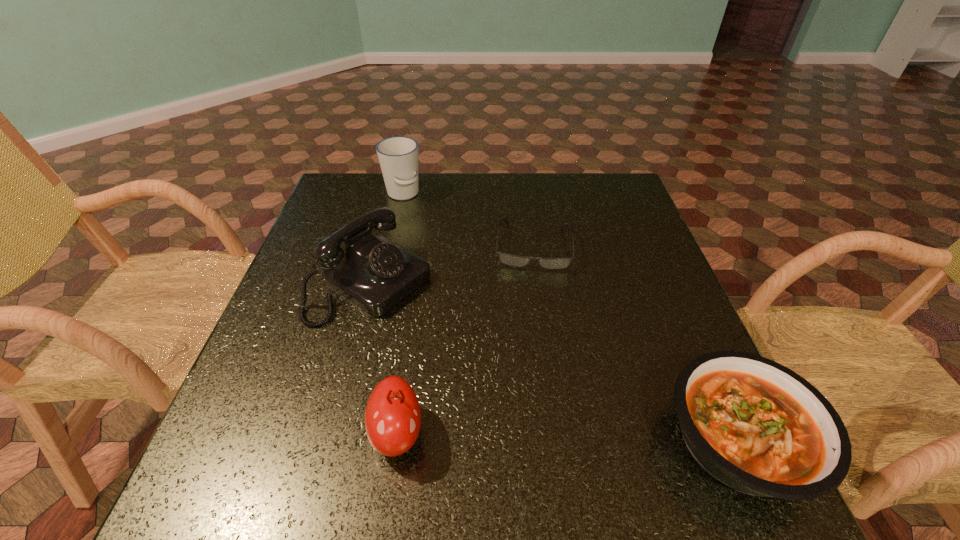
I want to click on vacant area that lies between the cup and the apple, so click(x=400, y=314).

Where is `object identified as the second closest to the third shortest object`? object identified as the second closest to the third shortest object is located at coordinates (514, 260).

Find the location of a particular element. This screenshot has height=540, width=960. the third closest object to the apple is located at coordinates (756, 426).

Where is `free space in the image that satisfies the following two spatial constraints: 1. on the front side of the second object from right to left; 2. on the left side of the rightmost object`? free space in the image that satisfies the following two spatial constraints: 1. on the front side of the second object from right to left; 2. on the left side of the rightmost object is located at coordinates (561, 441).